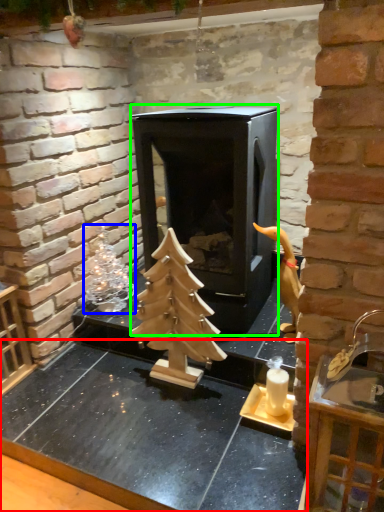
Question: Which object is positioned farthest from counter top (highlighted by a red box)? Select from christmas decoration (highlighted by a blue box) and fireplace (highlighted by a green box).

Choices:
 (A) christmas decoration
 (B) fireplace

Answer: (B)